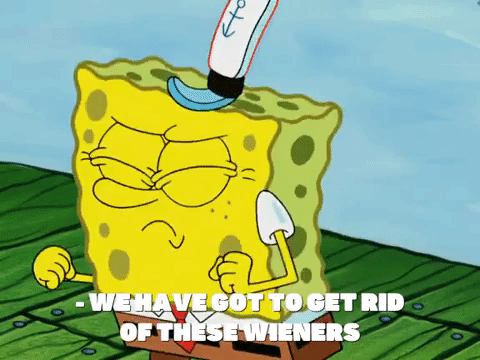
The image size is (480, 360). I want to click on wooden plank ground, so click(x=59, y=238), click(x=431, y=297), click(x=413, y=336).